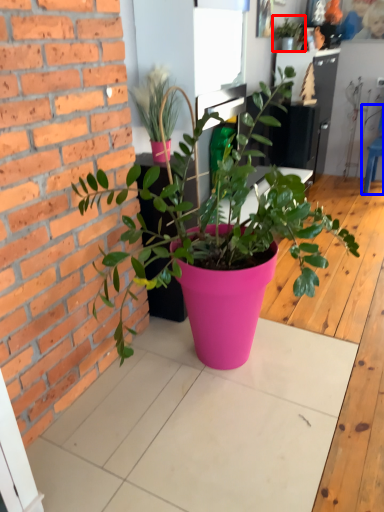
Question: Which point is closer to the camera, houseplant (highlighted by a red box) or chair (highlighted by a blue box)?

Choices:
 (A) houseplant
 (B) chair

Answer: (A)